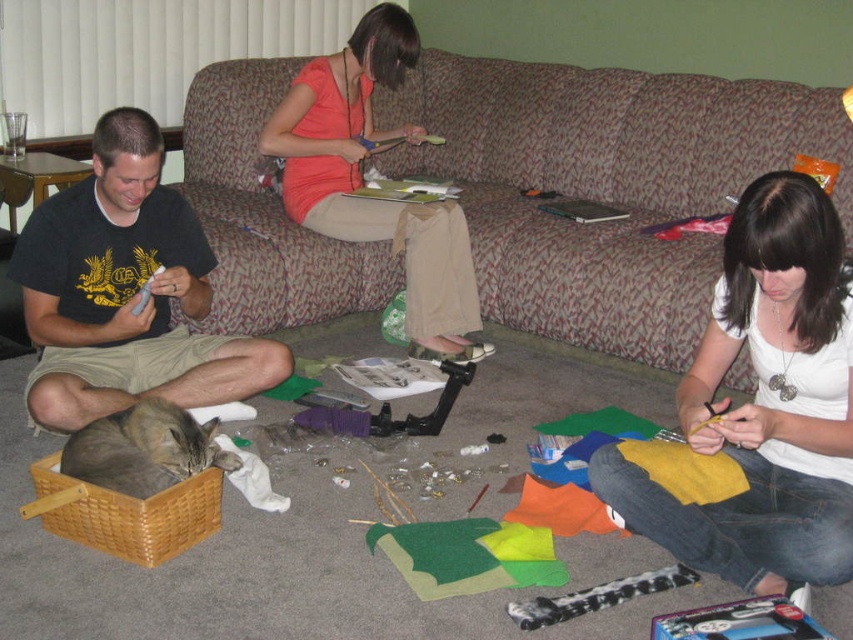
Question: Does textured fabric couch at center appear under orange cotton shirt at center?

Choices:
 (A) yes
 (B) no

Answer: (B)

Question: Which is nearer to the black t-shirt at left?

Choices:
 (A) textured fabric couch at center
 (B) white fabric at lower right

Answer: (B)

Question: Which point appears farthest from the camera in this image?

Choices:
 (A) coord(198,227)
 (B) coord(268,102)

Answer: (B)

Question: Which of these objects is positioned closest to the white fabric at lower right?

Choices:
 (A) orange cotton shirt at center
 (B) black t-shirt at left
 (C) textured fabric couch at center

Answer: (C)

Question: Does black t-shirt at left lie in front of orange cotton shirt at center?

Choices:
 (A) no
 (B) yes

Answer: (B)

Question: Can you confirm if white fabric at lower right is thinner than orange cotton shirt at center?

Choices:
 (A) yes
 (B) no

Answer: (A)